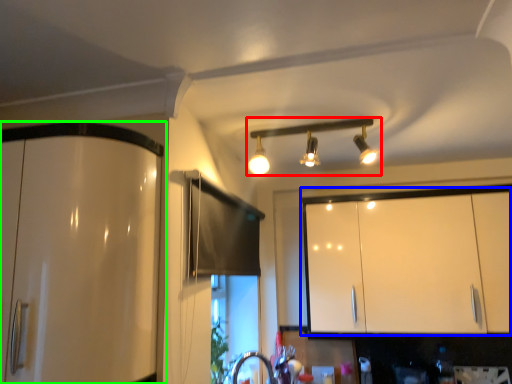
Question: Which is nearer to the lamp (highlighted by a red box)? cabinetry (highlighted by a blue box) or cabinetry (highlighted by a green box).

Choices:
 (A) cabinetry
 (B) cabinetry

Answer: (A)